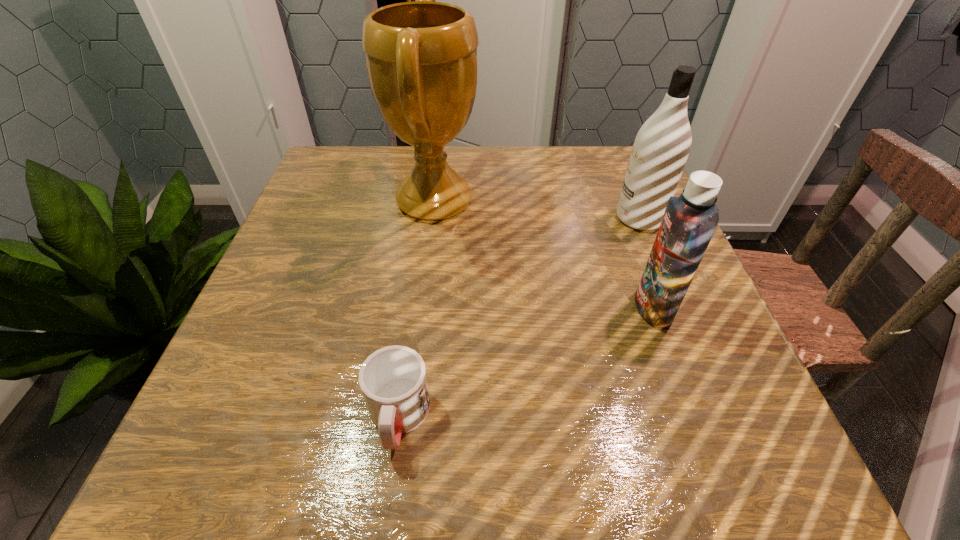
Where is `vacant space at the far left corner of the desktop`? vacant space at the far left corner of the desktop is located at coordinates (362, 171).

In the image, there is a desktop. In order to click on vacant space at the near left corner in this screenshot , I will do pyautogui.click(x=163, y=489).

Find the location of `blank space at the far right corner`. blank space at the far right corner is located at coordinates (600, 172).

At what (x,y) coordinates should I click in order to perform the action: click on vacant area that lies between the nearer shampoo and the taller shampoo. Please return your answer as a coordinate pair (x, y). Image resolution: width=960 pixels, height=540 pixels. Looking at the image, I should click on [646, 263].

Locate an element on the screen. This screenshot has height=540, width=960. free space between the shorter shampoo and the taller shampoo is located at coordinates click(646, 263).

Find the location of a particular element. This screenshot has height=540, width=960. free space between the nearest object and the nearer shampoo is located at coordinates (526, 362).

You are a GUI agent. You are given a task and a screenshot of the screen. Output one action in this format:
    pyautogui.click(x=<x>, y=<y>)
    Task: Click on the vacant area that lies between the taller shampoo and the tallest object
    Image resolution: width=960 pixels, height=540 pixels.
    Given the screenshot: What is the action you would take?
    pyautogui.click(x=537, y=210)

Identify the location of free space between the shorter shampoo and the second tallest object. (646, 263).

Identify the location of empty location between the award and the nearest object. (417, 309).

This screenshot has height=540, width=960. Identify the location of unoccupied position between the shortest object and the award. (417, 309).